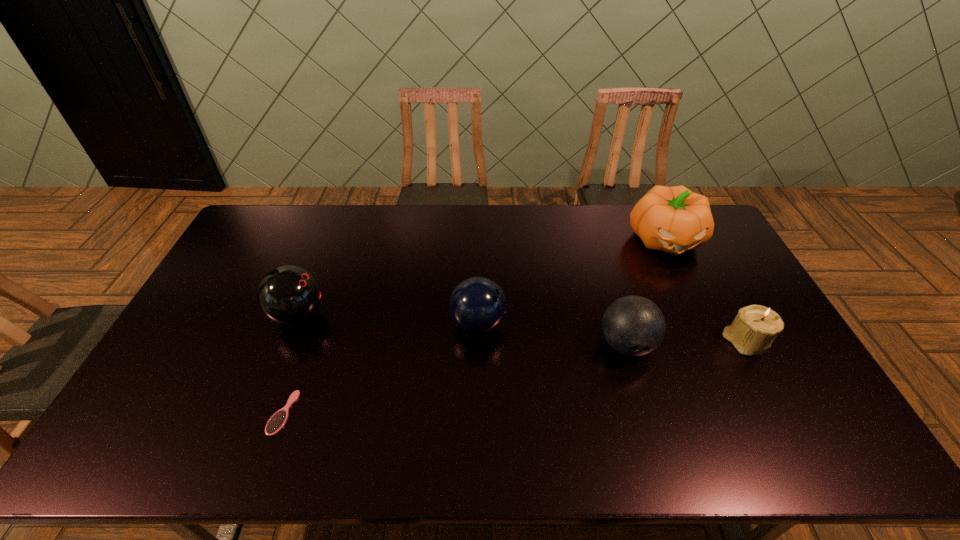
Locate an element on the screen. pumpkin is located at coordinates (674, 219).

You are a GUI agent. You are given a task and a screenshot of the screen. Output one action in this format:
    pyautogui.click(x=<x>, y=<y>)
    Task: Click on the leftmost bowling ball
    The width and height of the screenshot is (960, 540).
    Given the screenshot: What is the action you would take?
    pyautogui.click(x=288, y=295)

What are the coordinates of `the third object from right to left` in the screenshot? It's located at (633, 325).

This screenshot has width=960, height=540. I want to click on the third object from left to right, so click(x=477, y=305).

Find the location of a particular element. candle_holder is located at coordinates (755, 327).

Identify the location of the nearest object. (277, 421).

The width and height of the screenshot is (960, 540). Find the location of `the shortest object`. the shortest object is located at coordinates (277, 421).

The image size is (960, 540). In order to click on vacant space situated on the carved face of the pumpkin in this screenshot , I will do `click(718, 349)`.

Identify the location of blank space located 0.070m on the surface of the leftmost bowling ball near the finger holes. Image resolution: width=960 pixels, height=540 pixels. (349, 315).

The height and width of the screenshot is (540, 960). Find the location of `vacant space located on the grip area of the rightmost bowling ball`. vacant space located on the grip area of the rightmost bowling ball is located at coordinates (641, 394).